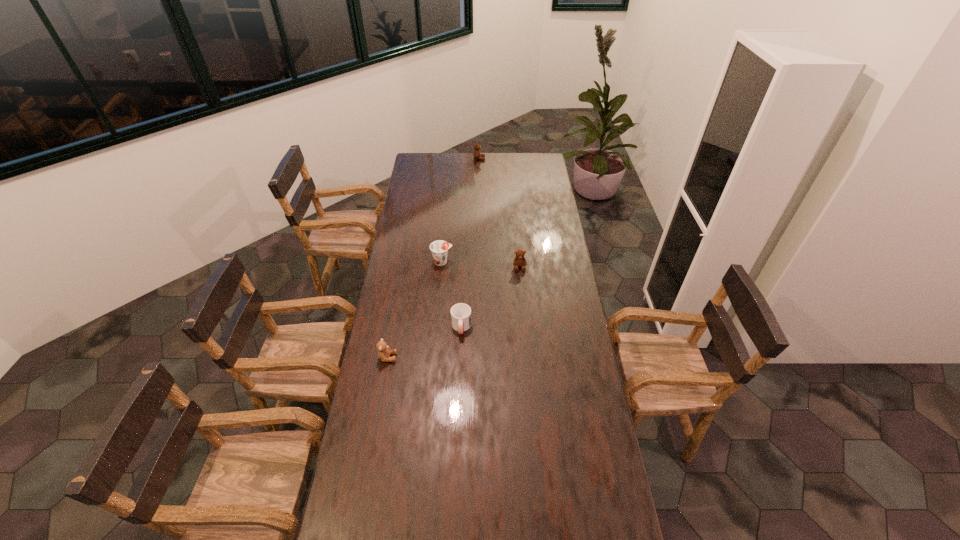
The width and height of the screenshot is (960, 540). In order to click on the farthest teddy bear in this screenshot , I will do `click(477, 155)`.

Locate an element on the screen. the farthest object is located at coordinates (477, 155).

I want to click on yogurt, so click(439, 248).

You are a GUI agent. You are given a task and a screenshot of the screen. Output one action in this format:
    pyautogui.click(x=<x>, y=<y>)
    Task: Click on the nearest object
    This screenshot has width=960, height=540.
    Given the screenshot: What is the action you would take?
    pyautogui.click(x=384, y=352)

I want to click on the leftmost teddy bear, so click(x=384, y=352).

The image size is (960, 540). What are the coordinates of `the rightmost object` in the screenshot? It's located at (519, 261).

Find the location of a particular element. the rightmost teddy bear is located at coordinates (519, 261).

This screenshot has height=540, width=960. I want to click on mug, so click(x=460, y=313).

Find the location of a particular element. free space located 0.390m at the face of the farthest object is located at coordinates (546, 159).

The width and height of the screenshot is (960, 540). I want to click on free region located on the back of the yogurt, so click(x=446, y=216).